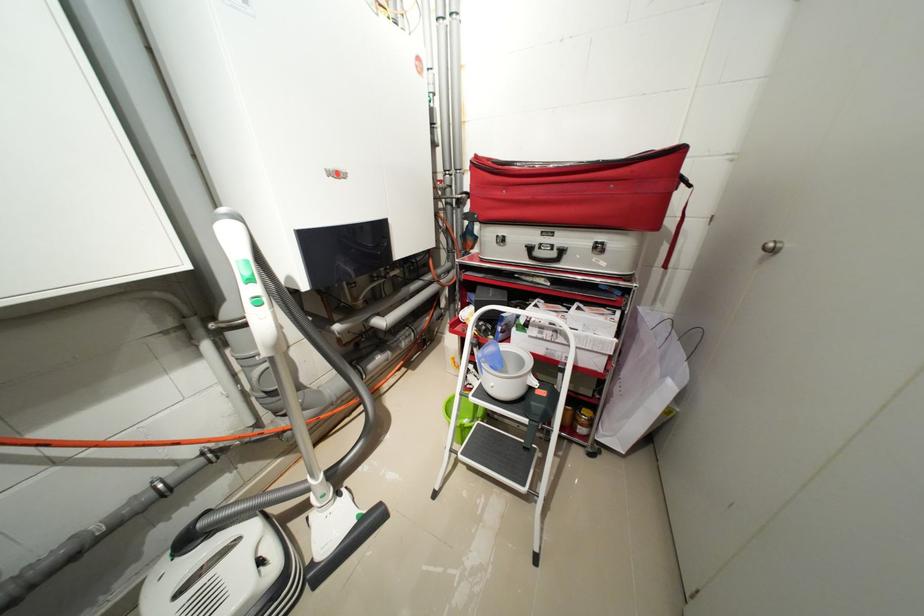
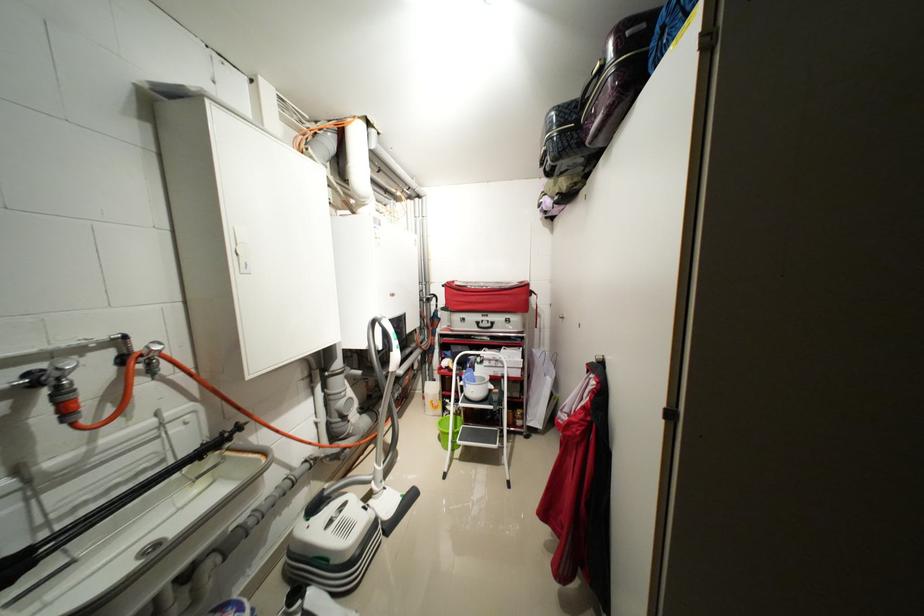
The point at [549,329] is marked in the first image. Where is the corresponding point in the second image?

(496, 361)